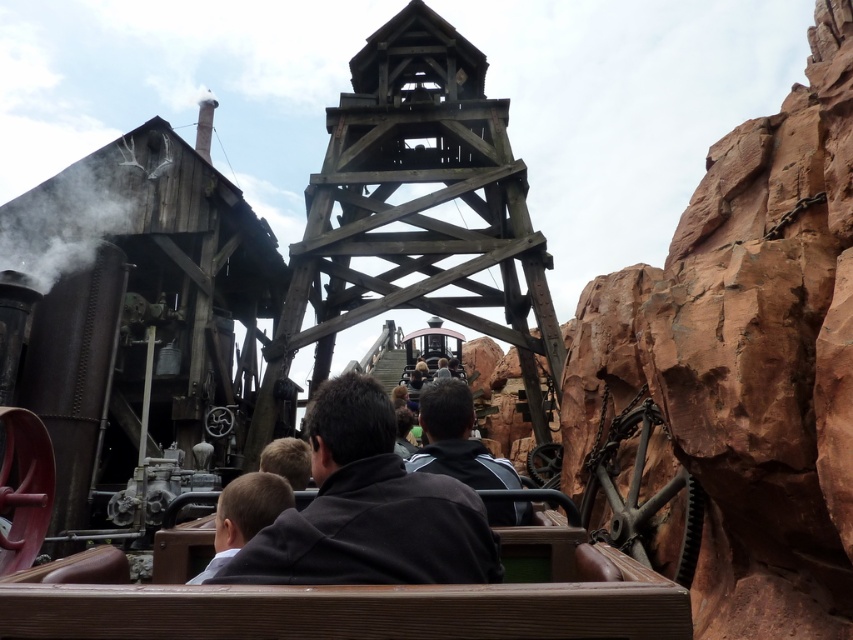
Question: Which object is closer to the camera taking this photo?

Choices:
 (A) black matte steam at left
 (B) rusty metal steam engine at left

Answer: (B)

Question: Does dark gray hoodie at center appear on the left side of light brown leather jacket at lower center?

Choices:
 (A) yes
 (B) no

Answer: (B)

Question: Which of the following is the farthest from the observer?

Choices:
 (A) (451, 412)
 (B) (7, 204)
 (C) (225, 515)

Answer: (B)

Question: Estimate the real-world distances between objects in this image. Which object is closer to the rusty metal steam engine at left?

Choices:
 (A) dark gray fabric at center
 (B) light brown leather jacket at lower center
 (C) dark gray hoodie at center
 (D) black matte steam at left

Answer: (D)

Question: Does dark gray fabric at center have a larger size compared to light brown leather jacket at lower center?

Choices:
 (A) yes
 (B) no

Answer: (A)

Question: Is wooden at center to the right of dark gray fabric at center from the viewer's perspective?

Choices:
 (A) no
 (B) yes

Answer: (B)